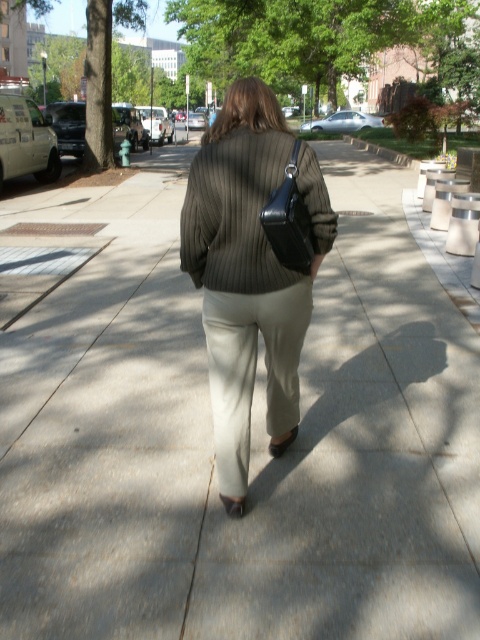
Does ribbed wool sweater at center have a smaller size compared to black leather bag at center?

Result: Incorrect, ribbed wool sweater at center is not smaller in size than black leather bag at center.

Image resolution: width=480 pixels, height=640 pixels. What do you see at coordinates (233, 212) in the screenshot?
I see `ribbed wool sweater at center` at bounding box center [233, 212].

Who is more forward, (305, 196) or (297, 268)?

Point (305, 196) is in front.

The image size is (480, 640). I want to click on ribbed wool sweater at center, so click(233, 212).

This screenshot has width=480, height=640. What do you see at coordinates (250, 273) in the screenshot? I see `ribbed sweater at center` at bounding box center [250, 273].

Does ribbed sweater at center appear over ribbed wool sweater at center?

Actually, ribbed sweater at center is below ribbed wool sweater at center.

Does point (231, 385) come farther from viewer compared to point (256, 196)?

Yes, it is behind point (256, 196).

Where is `ribbed sweater at center`? ribbed sweater at center is located at coordinates coord(250,273).

Is ribbed sweater at center closer to camera compared to black leather bag at center?

No, ribbed sweater at center is further to the viewer.

Between ribbed sweater at center and black leather bag at center, which one has less height?

black leather bag at center

Who is more distant from viewer, [282,381] or [290,216]?

Point [282,381]

Identify the location of ribbed sweater at center. This screenshot has width=480, height=640. (250, 273).